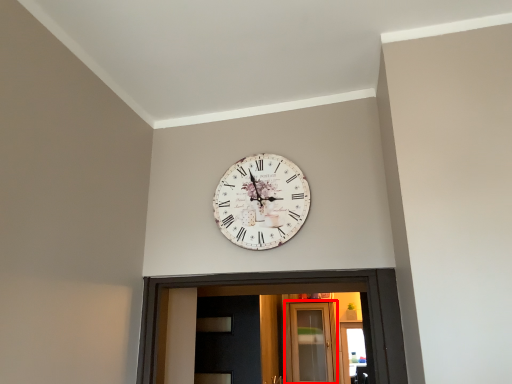
Question: From the image, what is the correct spatial relationship of glass door (annotated by the red box) in relation to wall clock?

Choices:
 (A) left
 (B) right

Answer: (B)